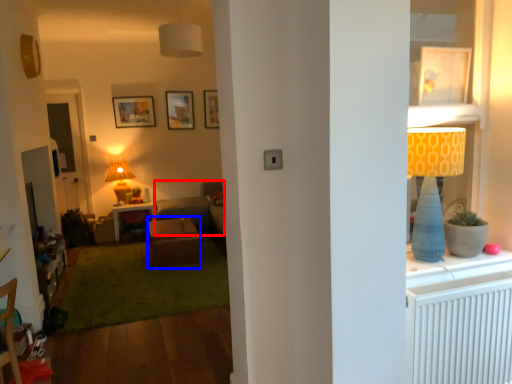
Question: Which object appears farthest to the camera in this image, studio couch (highlighted by a red box) or table (highlighted by a blue box)?

Choices:
 (A) studio couch
 (B) table

Answer: (A)